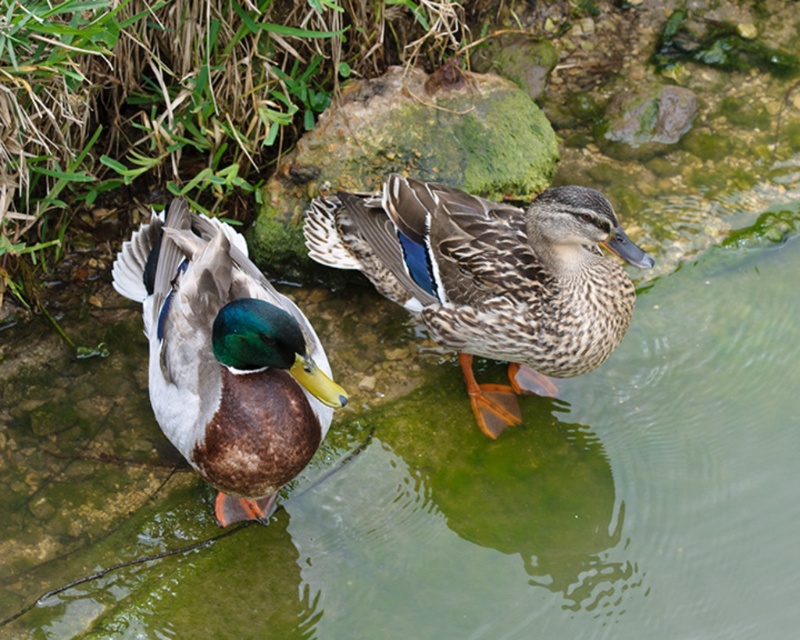
How much distance is there between shiny brown duck at left and green mossy rock at center?

shiny brown duck at left and green mossy rock at center are 3.34 feet apart.

Which is behind, point (137, 248) or point (306, 184)?

The point (306, 184) is behind.

The height and width of the screenshot is (640, 800). I want to click on shiny brown duck at left, so click(x=225, y=358).

Can you confirm if speckled feathered duck at center is positioned above green mossy rock at center?

Incorrect, speckled feathered duck at center is not positioned above green mossy rock at center.

Is point (552, 296) in front of point (454, 157)?

That is True.

Where is `speckled feathered duck at center`? speckled feathered duck at center is located at coordinates (490, 276).

Is speckled feathered duck at center above shiny brown duck at left?

Yes.

Who is more forward, (592, 348) or (310, 435)?

Point (310, 435) is more forward.

Image resolution: width=800 pixels, height=640 pixels. Identify the location of speckled feathered duck at center. (x=490, y=276).